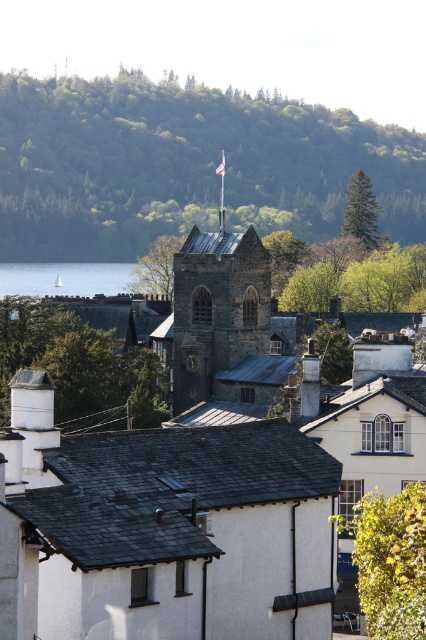
You are a tourist standing in the square in front of the historic stone church tower. You notice the dark gray slate roof at center and the transparent water at lower left in the scene. Can you determine which of these two elements is positioned higher from the ground level?

The dark gray slate roof at center is located below transparent water at lower left, meaning the transparent water at lower left is higher up from the ground level than the dark gray slate roof at center.

Based on the photo, you are standing at the center of the image and want to locate the dark gray slate roof at center. Which direction should you look to find it?

The dark gray slate roof at center is located at point coordinates of (170,483), so you should look towards the center of the image to find it.

You are an architect examining the historic stone church tower and its surrounding buildings. You notice two slate roofs at the center of the image. Which one is closer to you, the dark gray slate roof at center or the shiny slate roof at center?

The dark gray slate roof at center is closer to you because it is positioned in front of the shiny slate roof at center.